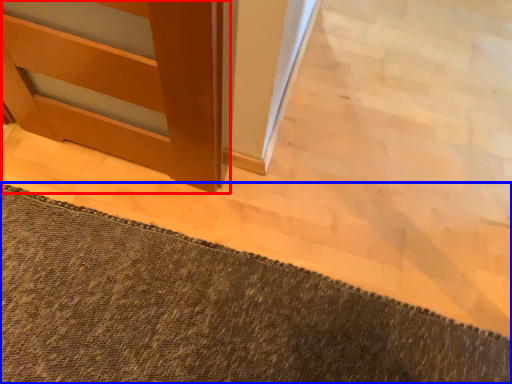
Question: Which object is further to the camera taking this photo, door (highlighted by a red box) or bath mat (highlighted by a blue box)?

Choices:
 (A) door
 (B) bath mat

Answer: (B)